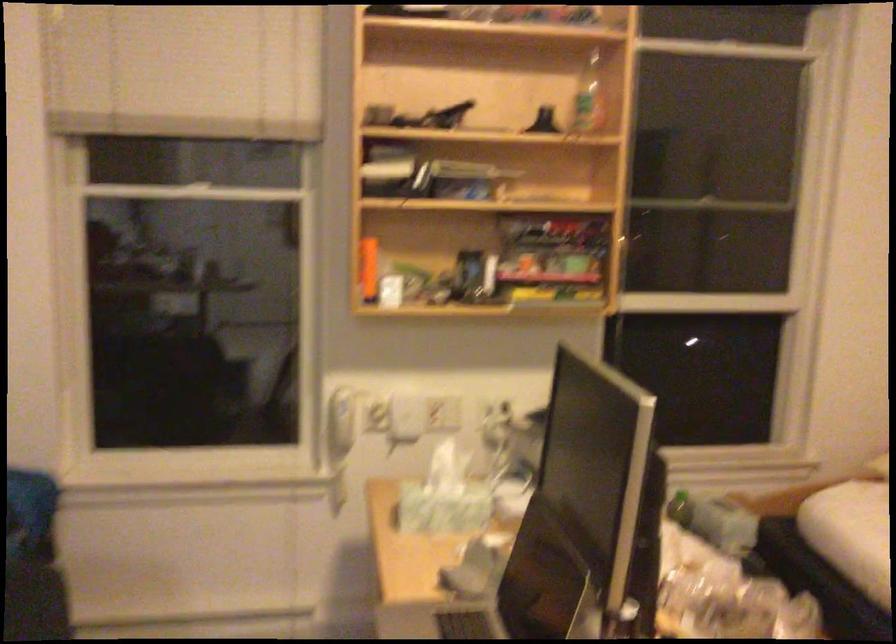
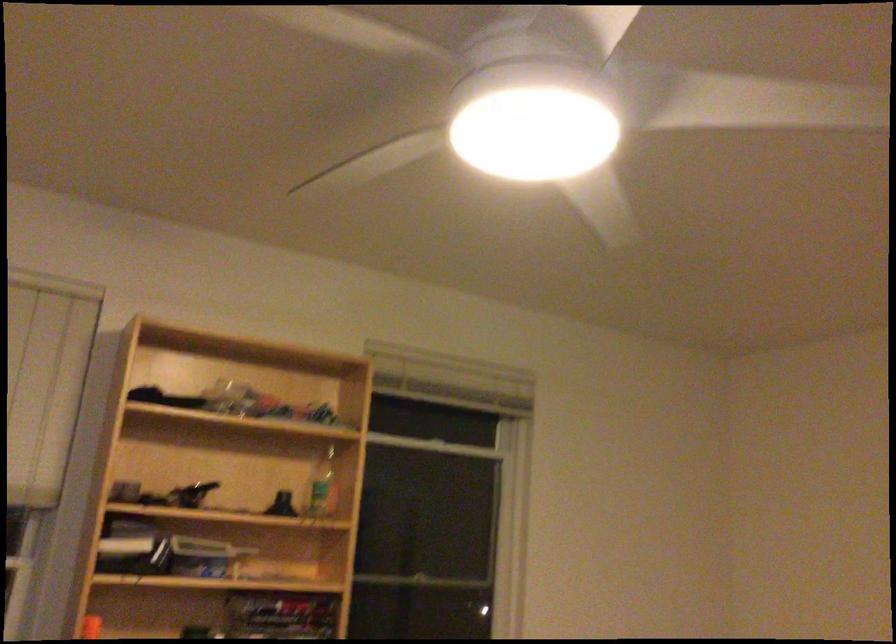
Based on the continuous images, in which direction is the camera rotating?

The camera's rotation is toward right-up.